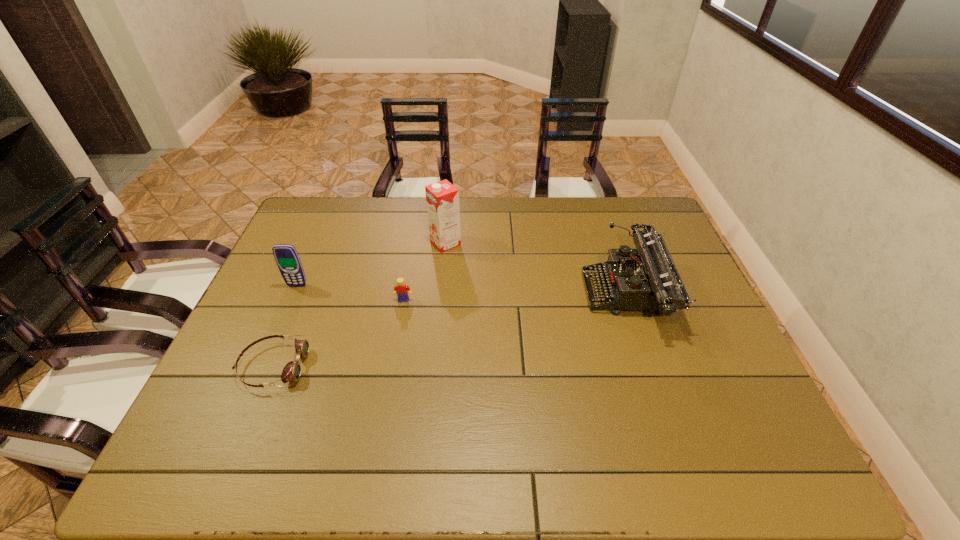
The width and height of the screenshot is (960, 540). I want to click on vacant region located on the keyboard of the typewriter, so click(543, 294).

I want to click on vacant space situated on the keyboard of the typewriter, so click(x=516, y=294).

The image size is (960, 540). Find the location of `vacant region located on the face of the Lego`. vacant region located on the face of the Lego is located at coordinates (393, 360).

This screenshot has width=960, height=540. I want to click on free space located 0.300m through the lenses of the shortest object, so (426, 366).

Locate an element on the screen. The image size is (960, 540). object that is at the far edge is located at coordinates (442, 198).

Locate an element on the screen. The width and height of the screenshot is (960, 540). cellular telephone present at the left edge is located at coordinates (288, 261).

Where is `goggles at the left edge`? This screenshot has width=960, height=540. goggles at the left edge is located at coordinates (291, 372).

What are the coordinates of `object located in the right edge section of the desktop` in the screenshot? It's located at (650, 281).

Image resolution: width=960 pixels, height=540 pixels. I want to click on blank space at the far edge of the desktop, so (501, 207).

This screenshot has height=540, width=960. I want to click on vacant space at the near edge, so click(x=315, y=444).